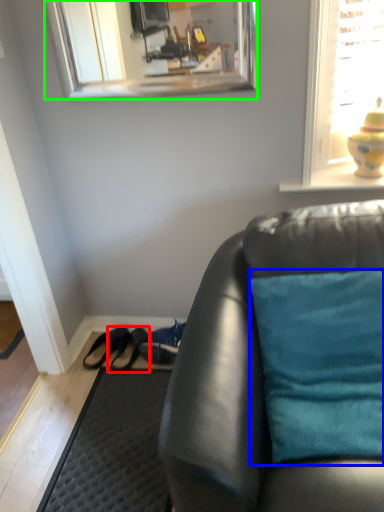
Question: Which object is positioned closest to shoe (highlighted by a red box)? Select from pillow (highlighted by a blue box) and mirror (highlighted by a green box).

Choices:
 (A) pillow
 (B) mirror

Answer: (A)